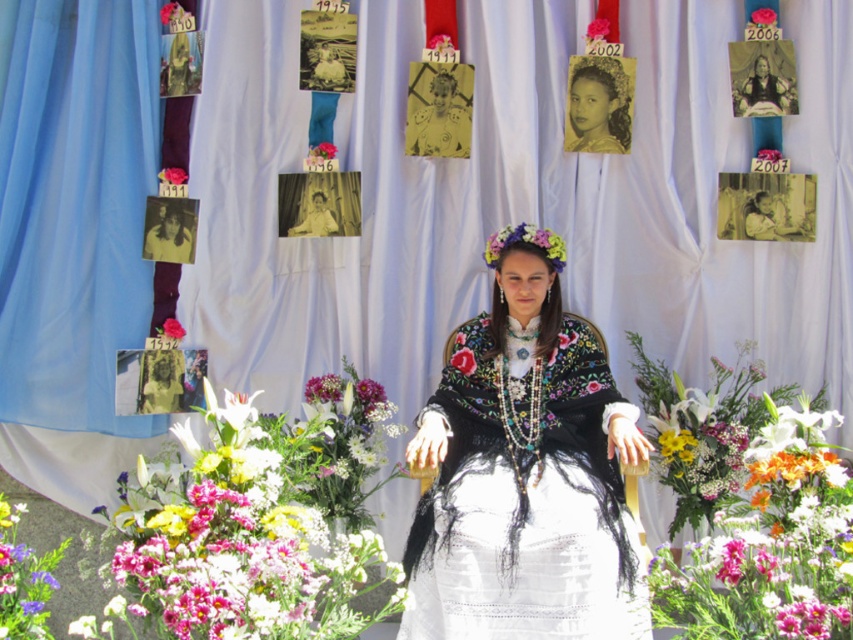
Question: Is embroidered velvet dress at center wider than pink fabric flower at upper center?

Choices:
 (A) no
 (B) yes

Answer: (B)

Question: Considering the real-world distances, which object is farthest from the pink fabric flower at center?

Choices:
 (A) vibrant bouquet of flowers at center
 (B) embroidered velvet dress at center
 (C) pink fabric flower at upper center

Answer: (C)

Question: Is fluffy bouquet of flowers at center wider than pink fabric flower at center?

Choices:
 (A) no
 (B) yes

Answer: (B)

Question: Considering the real-world distances, which object is farthest from the embroidered velvet dress at center?

Choices:
 (A) fluffy bouquet of flowers at center
 (B) pink fabric flower at center

Answer: (B)

Question: Can you confirm if embroidered velvet dress at center is positioned below vibrant bouquet of flowers at center?

Choices:
 (A) yes
 (B) no

Answer: (B)

Question: Which object appears farthest from the camera in this image?

Choices:
 (A) embroidered velvet dress at center
 (B) vibrant bouquet of flowers at center
 (C) fluffy bouquet of flowers at center

Answer: (A)